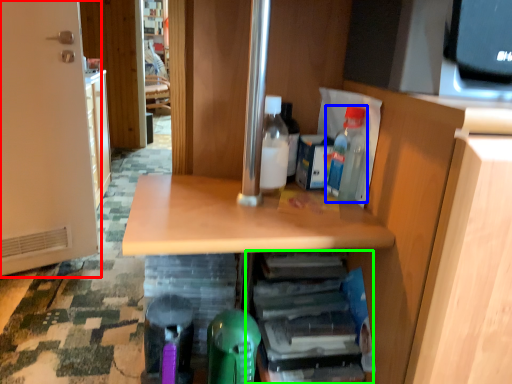
Question: Based on their relative distances, which object is nearer to door (highlighted by a red box)? Choose from bottle (highlighted by a blue box) and shelf (highlighted by a green box).

Choices:
 (A) bottle
 (B) shelf

Answer: (B)